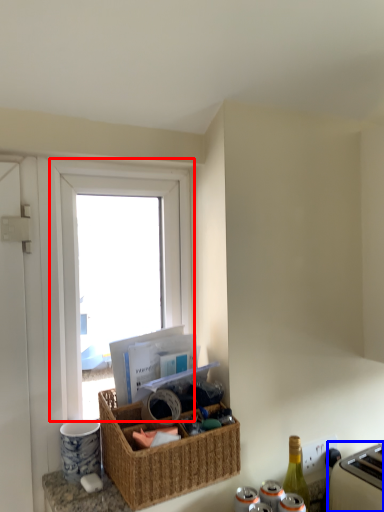
Question: Among these objects, which one is farthest to the camera, window (highlighted by a red box) or appliance (highlighted by a blue box)?

Choices:
 (A) window
 (B) appliance

Answer: (A)